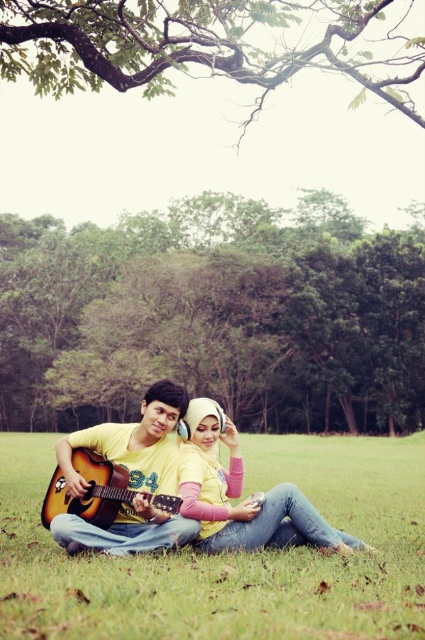
Question: Does green leafy tree at upper center have a lesser width compared to matte yellow shirt at center?

Choices:
 (A) yes
 (B) no

Answer: (B)

Question: Which object is positioned farthest from the acoustic wood guitar at left?

Choices:
 (A) green grass at center
 (B) green leafy tree at center
 (C) matte yellow shirt at center

Answer: (B)

Question: Considering the relative positions of matte yellow shirt at center and acoustic wood guitar at left in the image provided, where is matte yellow shirt at center located with respect to acoustic wood guitar at left?

Choices:
 (A) below
 (B) above

Answer: (A)

Question: Is green grass at center positioned at the back of matte yellow shirt at center?

Choices:
 (A) no
 (B) yes

Answer: (A)

Question: Which object is positioned closest to the green grass at center?

Choices:
 (A) green leafy tree at upper center
 (B) acoustic wood guitar at left
 (C) green leafy tree at center

Answer: (B)

Question: Which point is closer to the camera?

Choices:
 (A) (84, 451)
 (B) (252, 230)
 (C) (68, 608)
 (D) (251, 44)

Answer: (C)